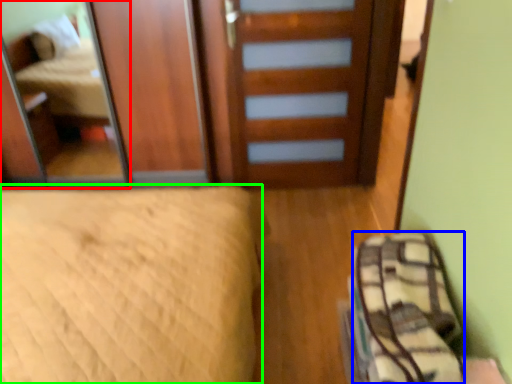
Question: Which object is the closest to the mirror (highlighted by a red box)? Choose among these: material (highlighted by a blue box) or bed (highlighted by a green box).

Choices:
 (A) material
 (B) bed

Answer: (B)